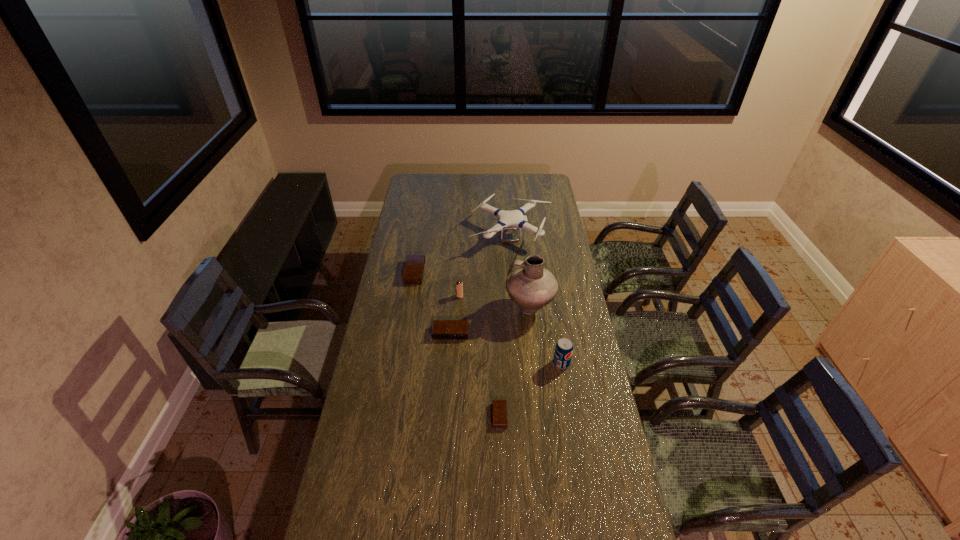
Identify the location of the leftmost alarm clock. (413, 272).

You are a GUI agent. You are given a task and a screenshot of the screen. Output one action in this format:
    pyautogui.click(x=<x>, y=<y>)
    Task: Click on the farthest alarm clock
    
    Given the screenshot: What is the action you would take?
    pyautogui.click(x=413, y=272)

I want to click on the second shortest object, so click(441, 329).

The width and height of the screenshot is (960, 540). Find the location of `the second alarm clock from left to right`. the second alarm clock from left to right is located at coordinates (441, 329).

I want to click on the rightmost alarm clock, so click(499, 407).

Where is `the nearest alarm clock`? The height and width of the screenshot is (540, 960). the nearest alarm clock is located at coordinates (499, 407).

You are a GUI agent. You are given a task and a screenshot of the screen. Output one action in this format:
    pyautogui.click(x=<x>, y=<y>)
    Task: Click on the drone
    Image resolution: width=960 pixels, height=540 pixels.
    Given the screenshot: What is the action you would take?
    pyautogui.click(x=516, y=217)

Find the location of a particular element. the second nearest object is located at coordinates (564, 348).

Find the location of a particular element. The width and height of the screenshot is (960, 540). the tallest object is located at coordinates (530, 286).

You are a GUI agent. You are given a task and a screenshot of the screen. Output one action in this format:
    pyautogui.click(x=<x>, y=<y>)
    Task: Click on the fourth shortest object
    The height and width of the screenshot is (540, 960).
    Given the screenshot: What is the action you would take?
    pyautogui.click(x=459, y=285)